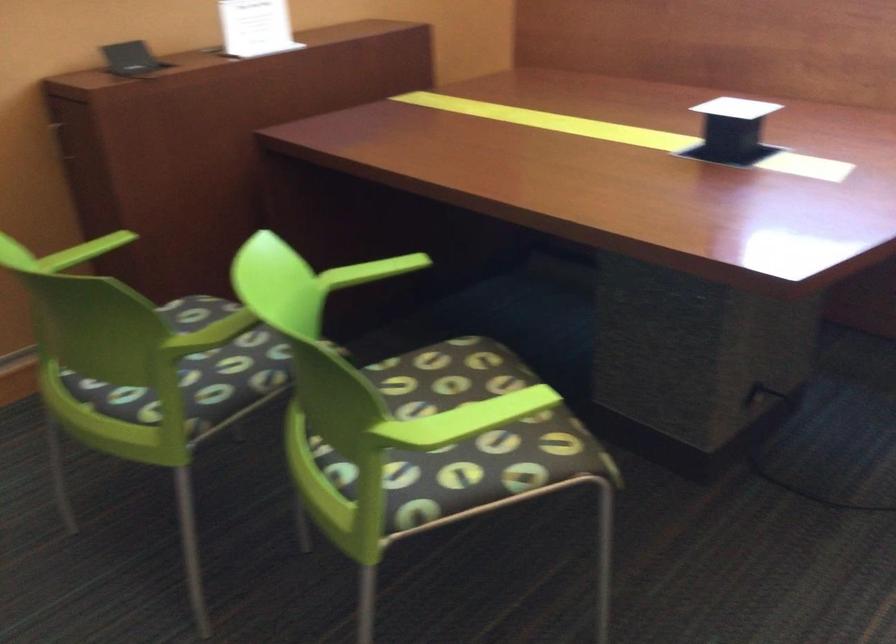
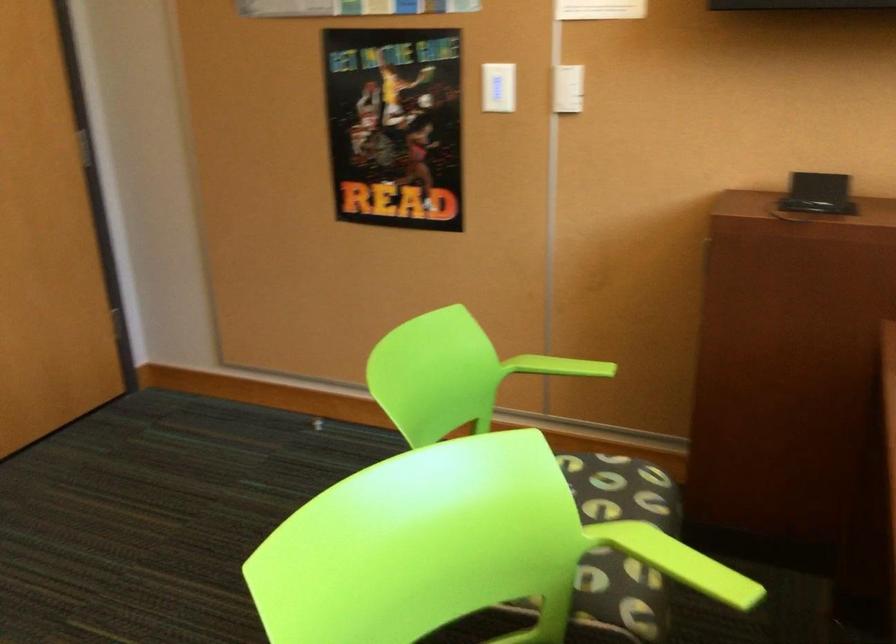
In the second image, find the point that corresponds to the point at 382,270 in the first image.

(685, 564)